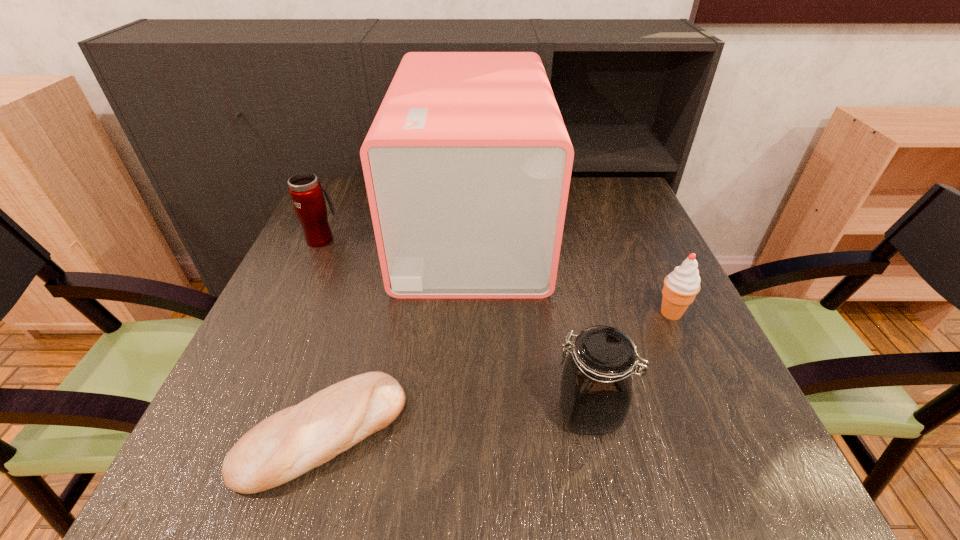
Image resolution: width=960 pixels, height=540 pixels. Find the location of `vacant space at the near edge`. vacant space at the near edge is located at coordinates (577, 483).

This screenshot has width=960, height=540. I want to click on vacant region at the left edge, so click(x=291, y=271).

This screenshot has height=540, width=960. Identify the location of free spot at the right edge of the desktop. (640, 331).

This screenshot has height=540, width=960. What are the coordinates of `vacant area at the far left corner` in the screenshot? It's located at point(344,186).

The height and width of the screenshot is (540, 960). I want to click on blank space at the far right corner, so click(x=597, y=182).

You are a GUI agent. You are given a task and a screenshot of the screen. Output one action in this format:
    pyautogui.click(x=<x>, y=<y>)
    Task: Click on the free space that is in between the box and the icecream
    
    Given the screenshot: What is the action you would take?
    pyautogui.click(x=571, y=271)

I want to click on free space between the icecream and the shortest object, so click(497, 373).

What are the coordinates of `free space that is in between the jar and the bread` in the screenshot? It's located at (456, 422).

The image size is (960, 540). Identify the location of empty location between the tallest object and the shortest object. (397, 330).

I want to click on free space between the box and the shortest object, so click(397, 330).